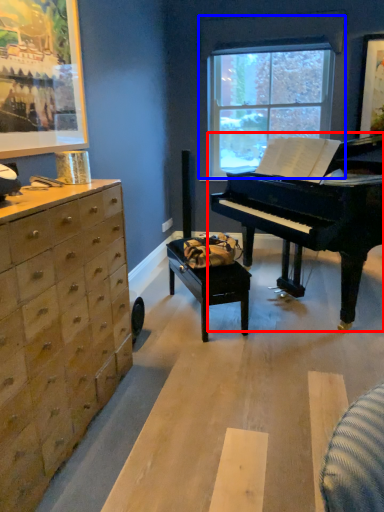
Question: Which object is further to the camera taking this photo, piano (highlighted by a red box) or window (highlighted by a blue box)?

Choices:
 (A) piano
 (B) window

Answer: (B)